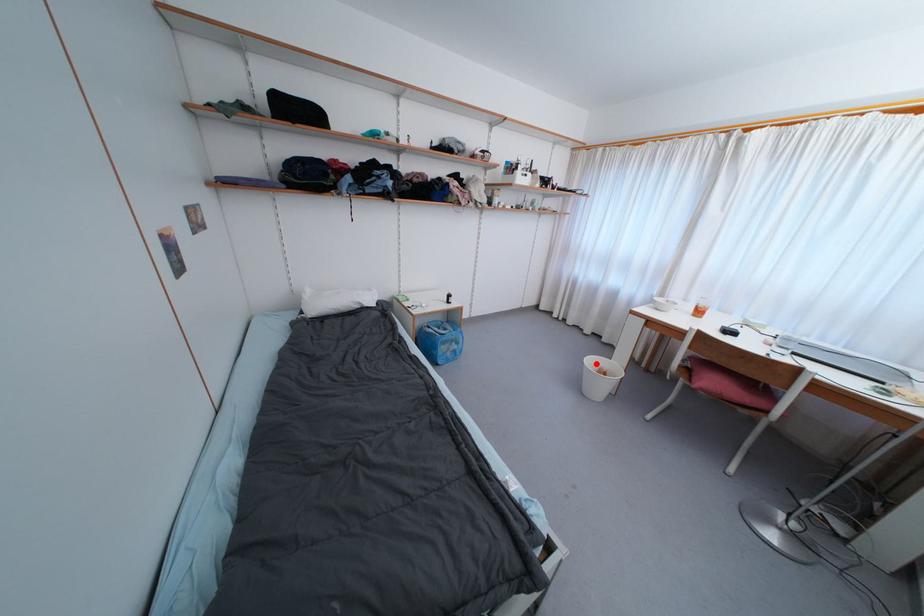
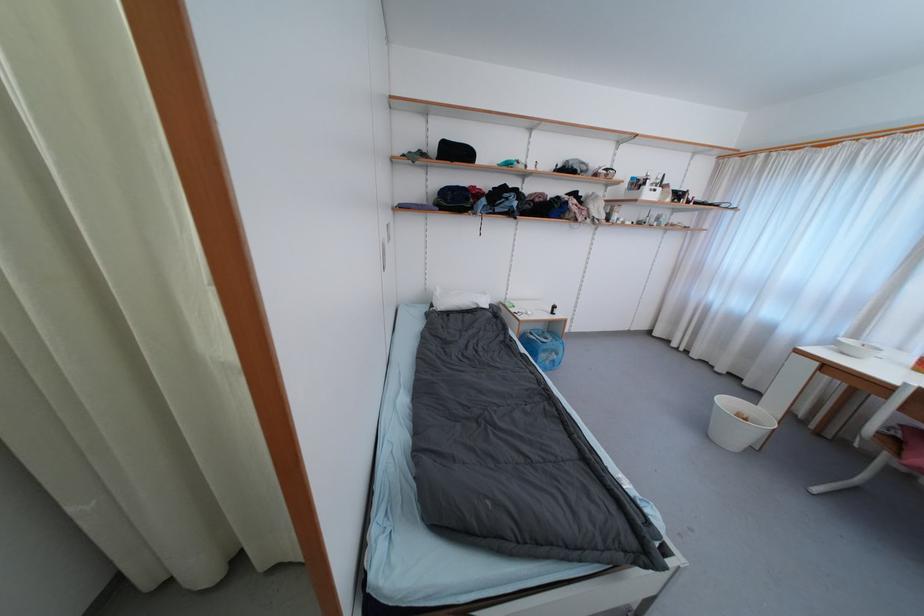
Locate, in the second image, the point that corresponds to the highlighted location in the first image.

(732, 405)